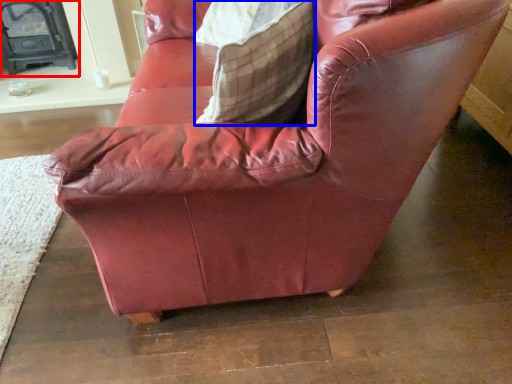
Question: Which of the following is the farthest to the observer, fireplace (highlighted by a red box) or throw pillow (highlighted by a blue box)?

Choices:
 (A) fireplace
 (B) throw pillow

Answer: (A)